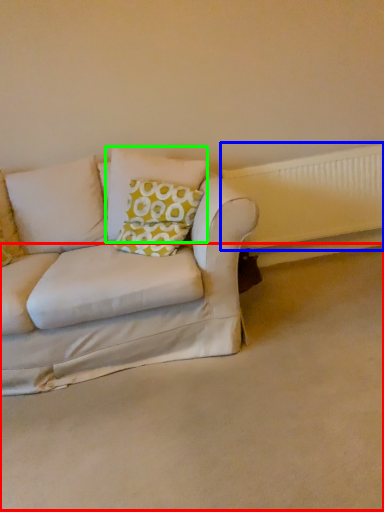
Question: Based on their relative distances, which object is nearer to plain (highlighted by a red box)? Choose from radiator (highlighted by a blue box) and pillow (highlighted by a green box).

Choices:
 (A) radiator
 (B) pillow

Answer: (B)